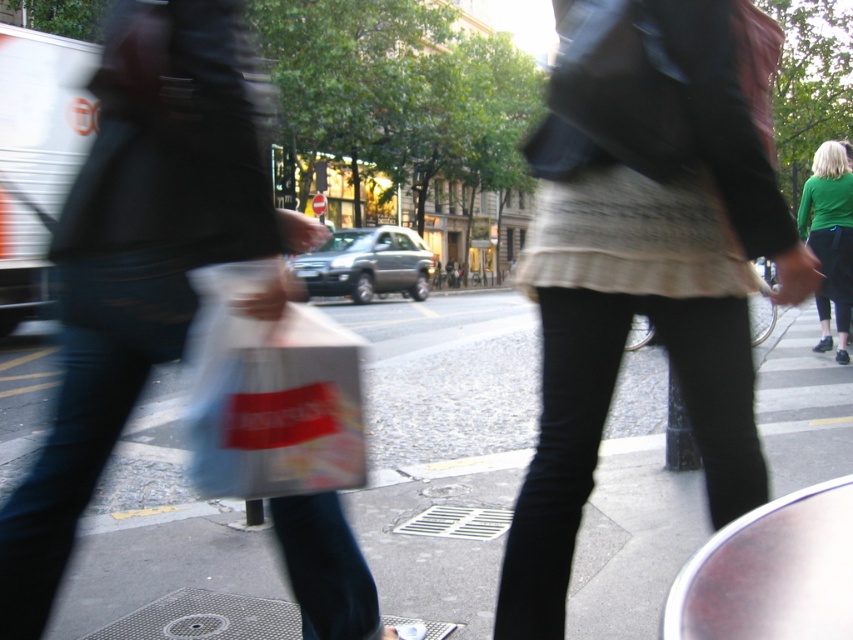
You are a photographer standing at the scene. You want to capture a clear photo of the translucent plastic bag at center without motion blur. What should you adjust in your camera settings to ensure the bag is sharp?

To capture a clear photo of the translucent plastic bag at center without motion blur, you should increase the shutter speed to freeze the motion. Since the bag is 5.26 feet away from the camera, ensuring a faster shutter speed will minimize blur caused by movement.